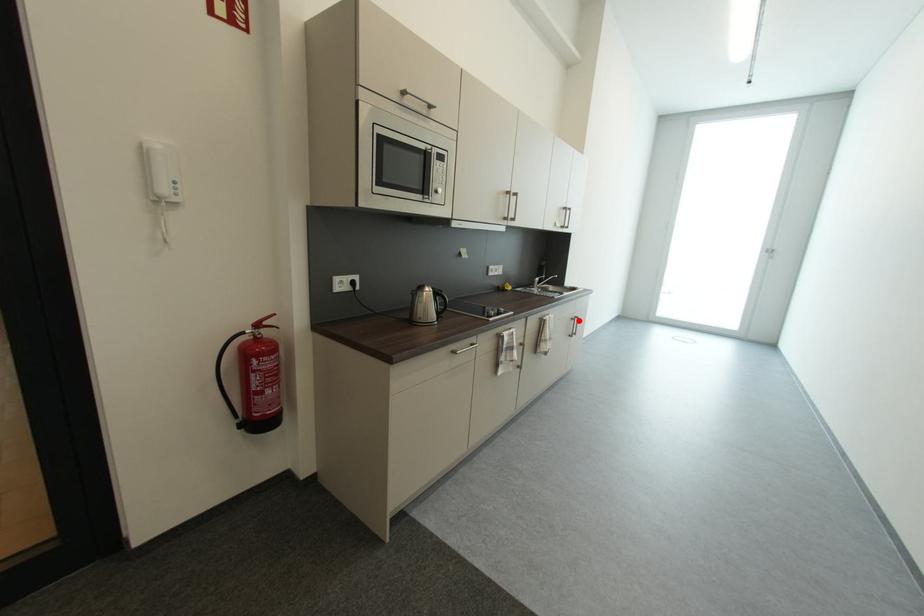
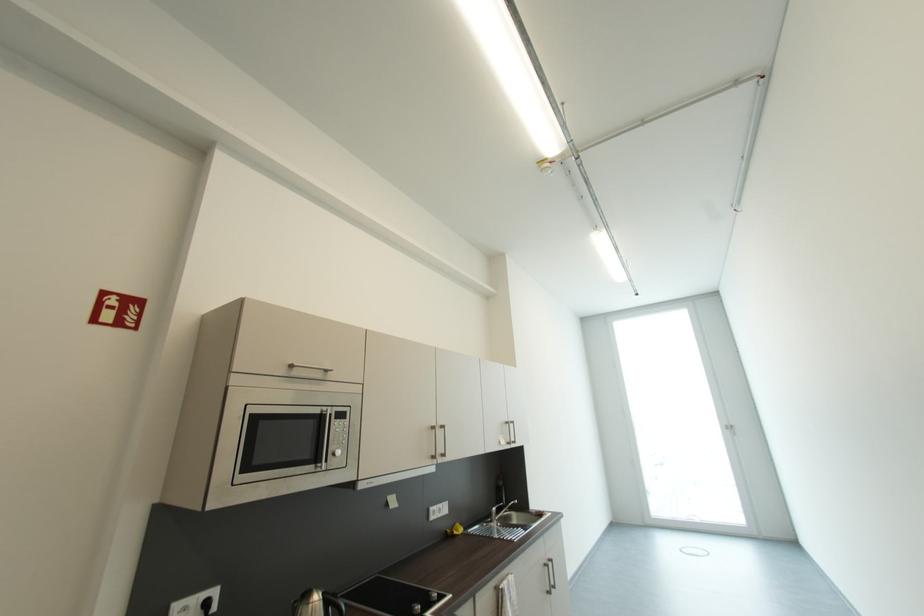
Locate, in the second image, the point that corresponds to the highlighted location in the first image.

(552, 567)